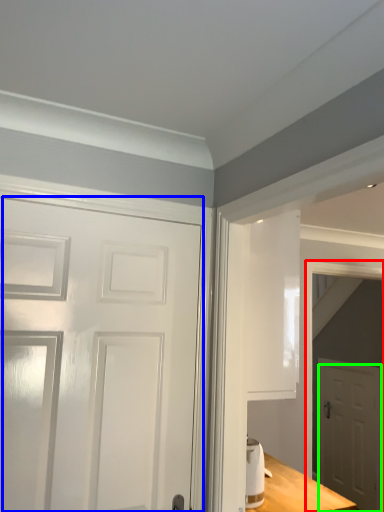
Question: Considering the real-world distances, which object is closest to elevator (highlighted by a red box)? door (highlighted by a blue box) or door (highlighted by a green box).

Choices:
 (A) door
 (B) door

Answer: (B)